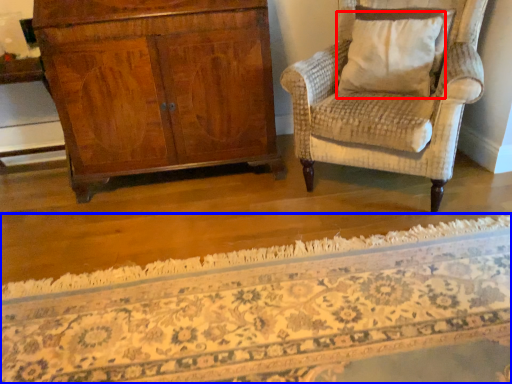
Question: Among these objects, which one is nearest to the camera, pillow (highlighted by a red box) or mat (highlighted by a blue box)?

Choices:
 (A) pillow
 (B) mat

Answer: (B)